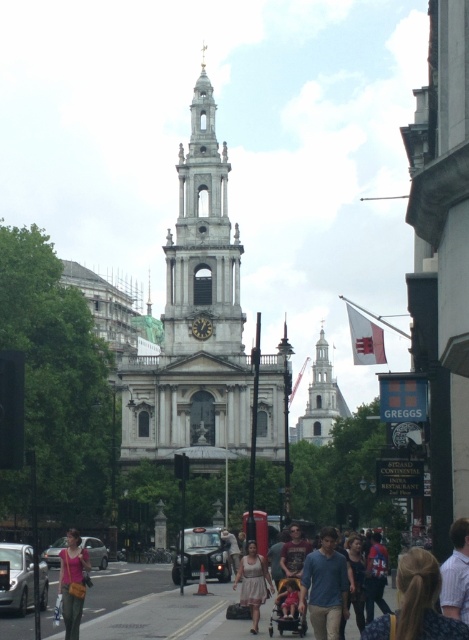
You are standing on the street looking at the church and its surroundings. There are two points marked in the image. Which point, point (77,630) or point (287,593), is closer to you?

Point (77,630) is closer to the viewer than point (287,593).

You are a delivery person trying to navigate through the busy street in front of the white stone tower at center. There is a dark gray plastic baby carriage at center in your path. Can you pass through the space between them without moving the baby carriage?

The white stone tower at center might be wider than dark gray plastic baby carriage at center, so there might not be enough space to pass through without moving the baby carriage.